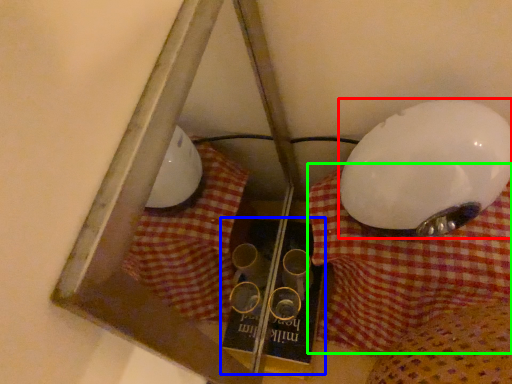
Question: Which object is positioned closest to lamp (highlighted by a red box)? Select from book (highlighted by a blue box) and tablecloth (highlighted by a green box).

Choices:
 (A) book
 (B) tablecloth

Answer: (B)